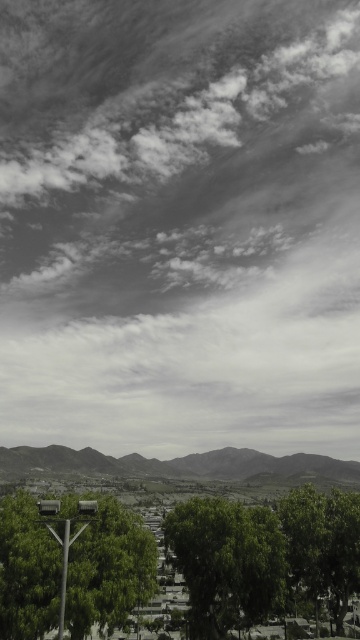
Question: Which object appears farthest from the camera in this image?

Choices:
 (A) gray matte mountain at lower center
 (B) green leafy tree at lower left

Answer: (A)

Question: Does green leafy tree at center have a smaller size compared to green leafy tree at lower right?

Choices:
 (A) no
 (B) yes

Answer: (B)

Question: Can you confirm if white fluffy cloud at upper center is positioned to the left of green leafy tree at lower right?

Choices:
 (A) yes
 (B) no

Answer: (A)

Question: Estimate the real-world distances between objects in this image. Which object is closer to the green leafy tree at lower right?

Choices:
 (A) gray matte mountain at lower center
 (B) green leafy tree at center

Answer: (B)

Question: Can you confirm if gray matte mountain at lower center is bigger than green leafy tree at lower right?

Choices:
 (A) yes
 (B) no

Answer: (A)

Question: Which object appears farthest from the camera in this image?

Choices:
 (A) green leafy tree at lower right
 (B) green leafy tree at lower left

Answer: (A)